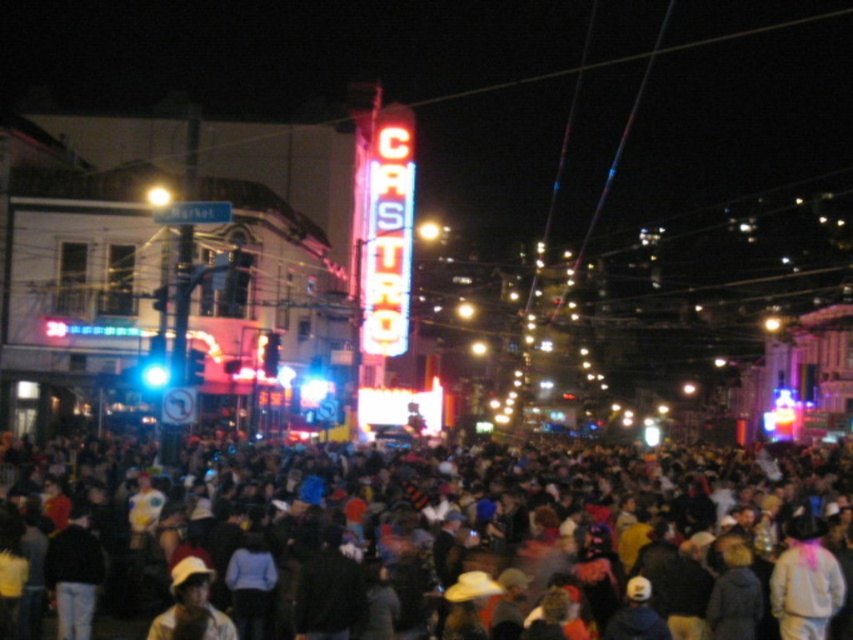
Question: Is multicolored fabric crowd at center below neon sign at center?

Choices:
 (A) no
 (B) yes

Answer: (B)

Question: Which point is closer to the camera?

Choices:
 (A) (799, 516)
 (B) (408, 124)

Answer: (A)

Question: Does multicolored fabric crowd at center appear under neon sign at center?

Choices:
 (A) yes
 (B) no

Answer: (A)

Question: Does multicolored fabric crowd at center have a greater width compared to neon sign at center?

Choices:
 (A) no
 (B) yes

Answer: (B)

Question: Which object appears closest to the camera in this image?

Choices:
 (A) multicolored fabric crowd at center
 (B) neon sign at center

Answer: (A)